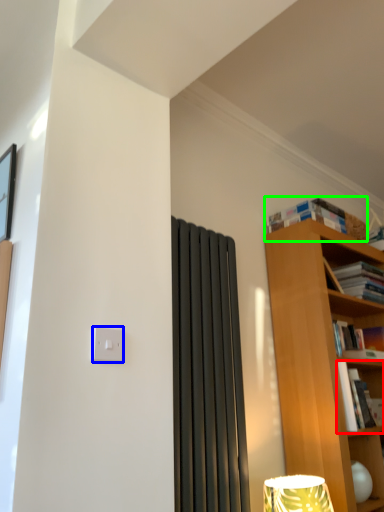
Question: Which is nearer to the book (highlighted by a red box)? light switch (highlighted by a blue box) or book (highlighted by a green box).

Choices:
 (A) light switch
 (B) book

Answer: (B)